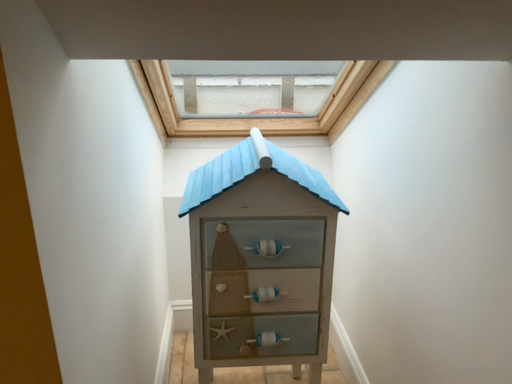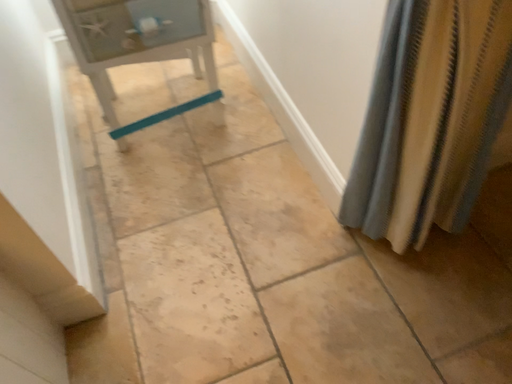
Question: How did the camera likely rotate when shooting the video?

Choices:
 (A) rotated upward
 (B) rotated downward

Answer: (B)